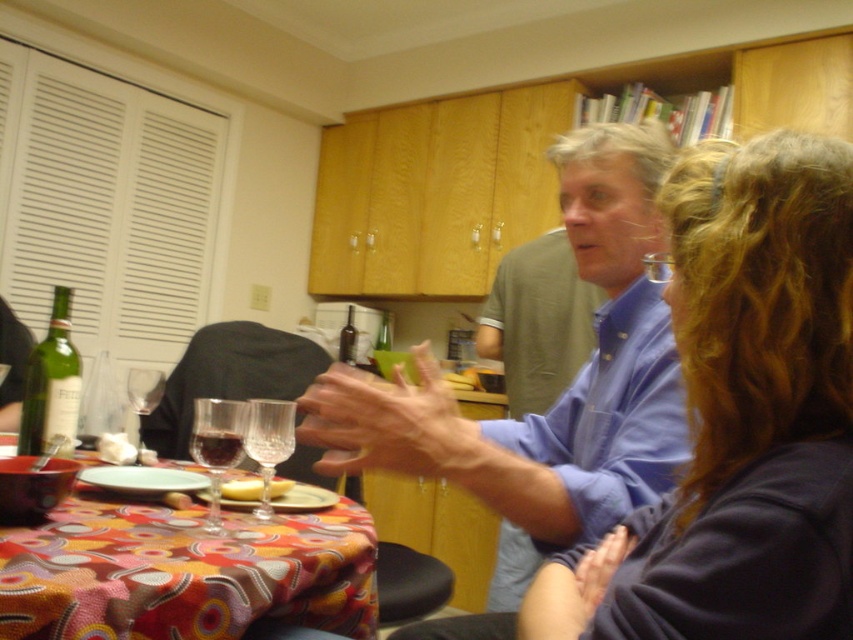
What is the 2D coordinate of the patterned fabric tablecloth at center?

The 2D coordinate of the patterned fabric tablecloth at center is at point (183, 572).